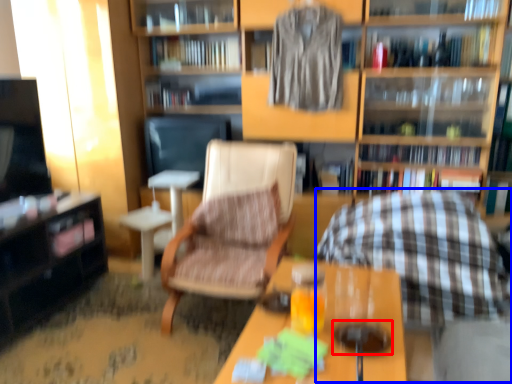
Question: Which object appears farthest to the camera in this image, beverage (highlighted by a red box) or rocking chair (highlighted by a blue box)?

Choices:
 (A) beverage
 (B) rocking chair

Answer: (B)